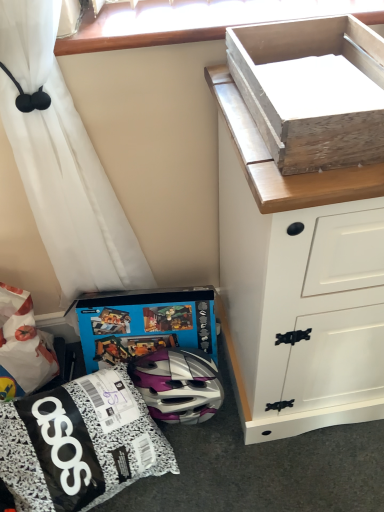
Question: Is white painted wood chest of drawers at upper right bigger or smaller than blue cardboard box at lower center?

Choices:
 (A) big
 (B) small

Answer: (A)

Question: Looking at their shapes, would you say white painted wood chest of drawers at upper right is wider or thinner than blue cardboard box at lower center?

Choices:
 (A) thin
 (B) wide

Answer: (B)

Question: Based on their relative distances, which object is nearer to the blue cardboard box at lower center?

Choices:
 (A) wooden box at upper right
 (B) matte black helmet at lower center
 (C) white painted wood chest of drawers at upper right

Answer: (B)

Question: Which object is positioned farthest from the blue cardboard box at lower center?

Choices:
 (A) matte black helmet at lower center
 (B) white painted wood chest of drawers at upper right
 (C) wooden box at upper right

Answer: (C)